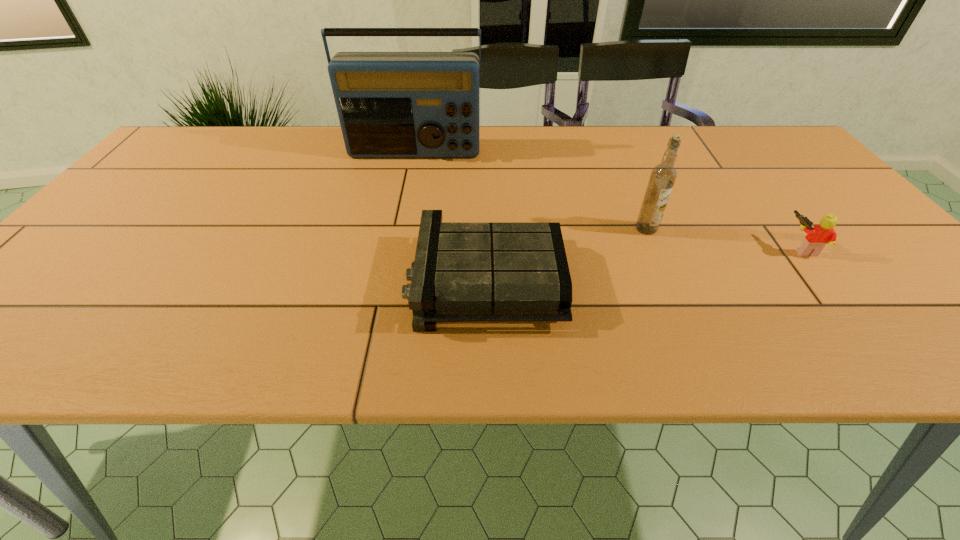
Locate an element on the screen. The height and width of the screenshot is (540, 960). vacant space located in front of the second shortest object with the accessory visible is located at coordinates [714, 248].

You are a GUI agent. You are given a task and a screenshot of the screen. Output one action in this format:
    pyautogui.click(x=<x>, y=<y>)
    Task: Click on the free space located in front of the second shortest object with the accessory visible
    
    Given the screenshot: What is the action you would take?
    click(645, 248)

You are a GUI agent. You are given a task and a screenshot of the screen. Output one action in this format:
    pyautogui.click(x=<x>, y=<y>)
    Task: Click on the vacant space located 0.240m in front of the second shortest object with the accessory visible
    The width and height of the screenshot is (960, 540).
    Given the screenshot: What is the action you would take?
    pyautogui.click(x=678, y=248)

This screenshot has width=960, height=540. What are the coordinates of `vacant space located 0.260m on the front panel of the shortest object` in the screenshot? It's located at pyautogui.click(x=284, y=281).

The image size is (960, 540). I want to click on free location located 0.150m on the front panel of the shortest object, so click(x=338, y=281).

This screenshot has height=540, width=960. What are the coordinates of `vacant space located on the front panel of the shortest object` in the screenshot? It's located at (250, 281).

I want to click on object present at the far edge, so click(390, 104).

Identify the location of object that is at the near edge. Image resolution: width=960 pixels, height=540 pixels. (x=463, y=272).

At what (x,y) coordinates should I click in order to perform the action: click on object that is at the right edge. Please return your answer as a coordinate pair (x, y). This screenshot has height=540, width=960. Looking at the image, I should click on (819, 235).

Where is `vacant area at the far edge of the desktop`? Image resolution: width=960 pixels, height=540 pixels. vacant area at the far edge of the desktop is located at coordinates (248, 145).